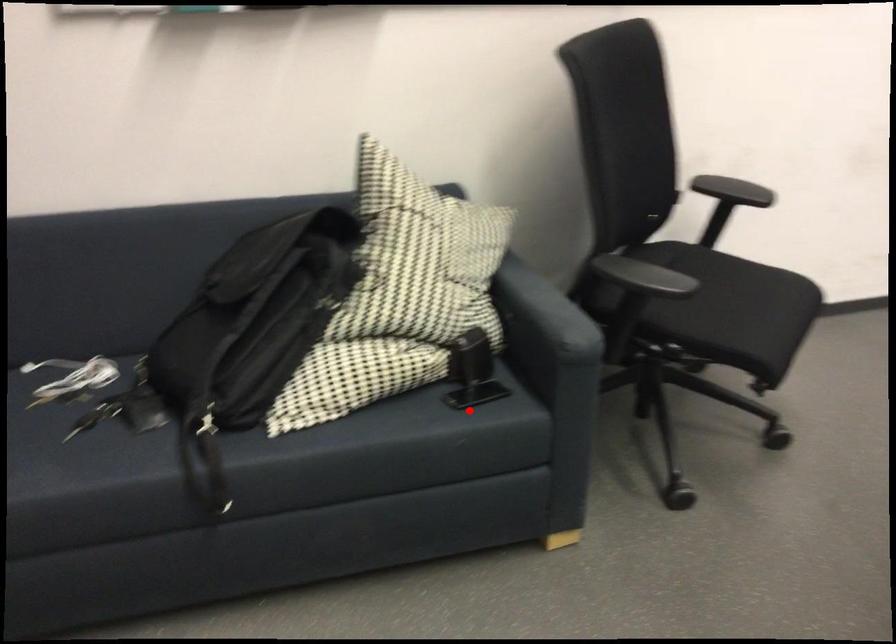
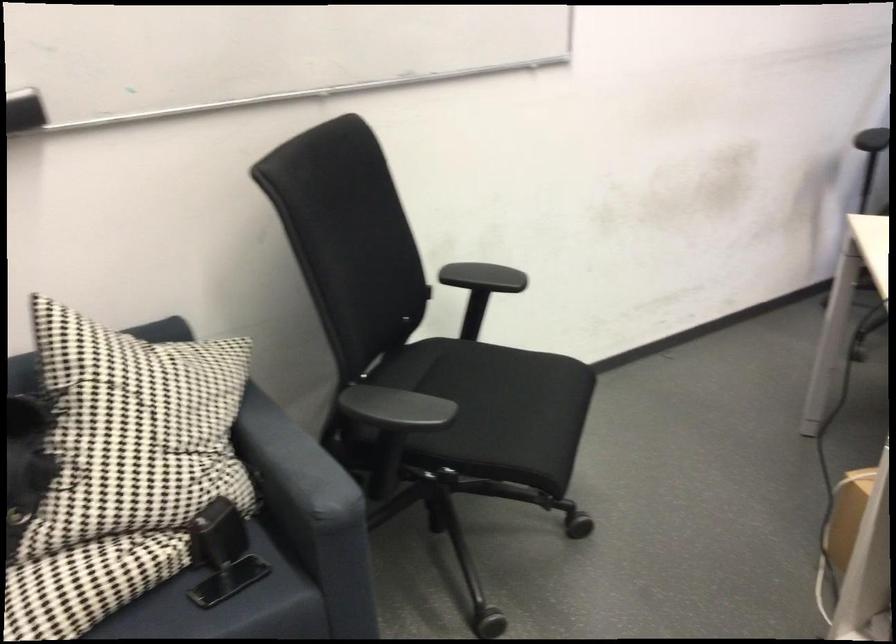
Find the pixel in the second image that matches the highlighted location in the first image.

(226, 605)